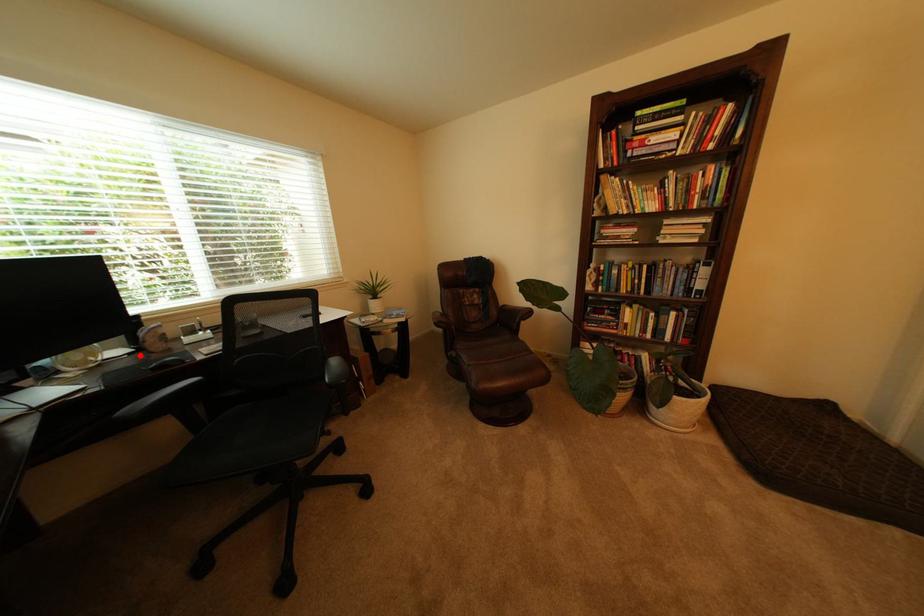
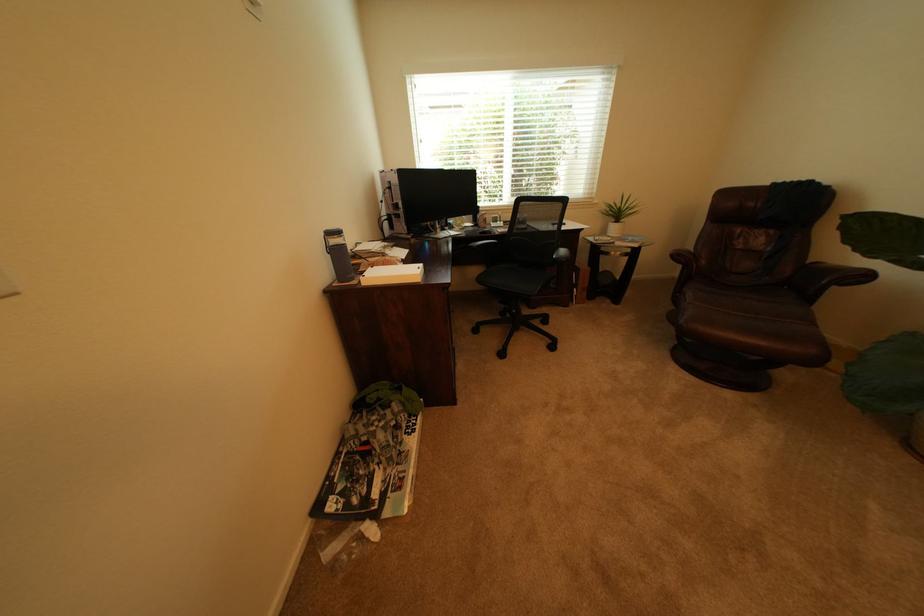
Where in the second image is the point corresponding to the highlighted location from the first image?

(482, 228)